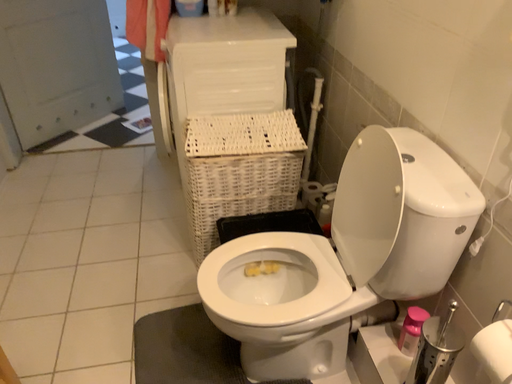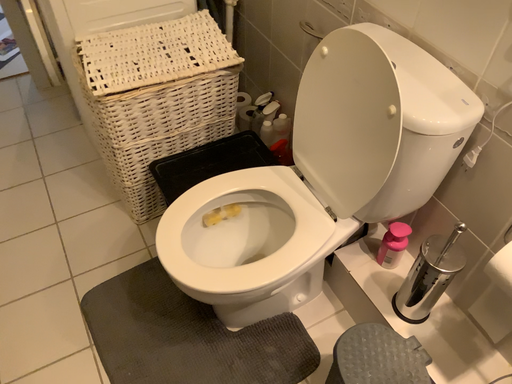
Question: How did the camera likely rotate when shooting the video?

Choices:
 (A) rotated right
 (B) rotated left

Answer: (A)